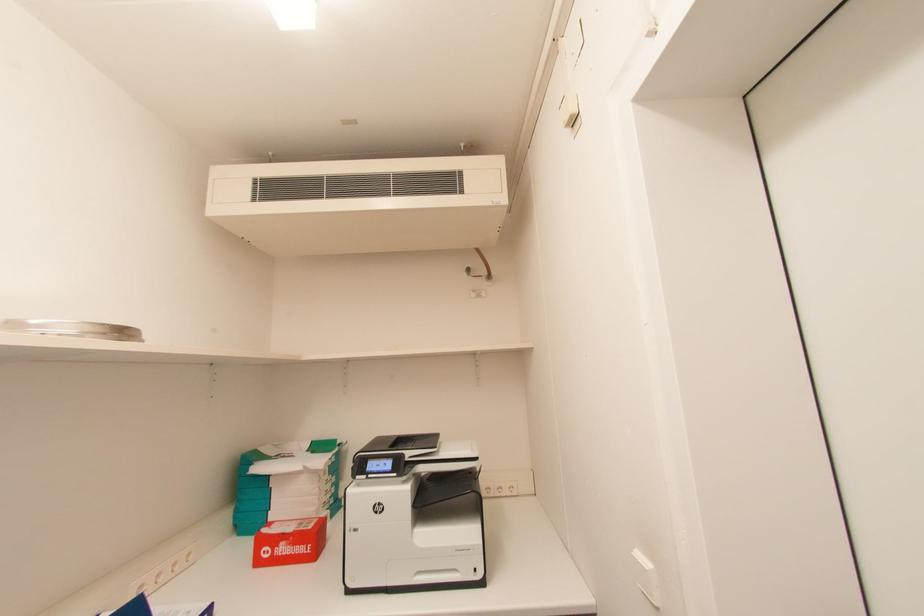
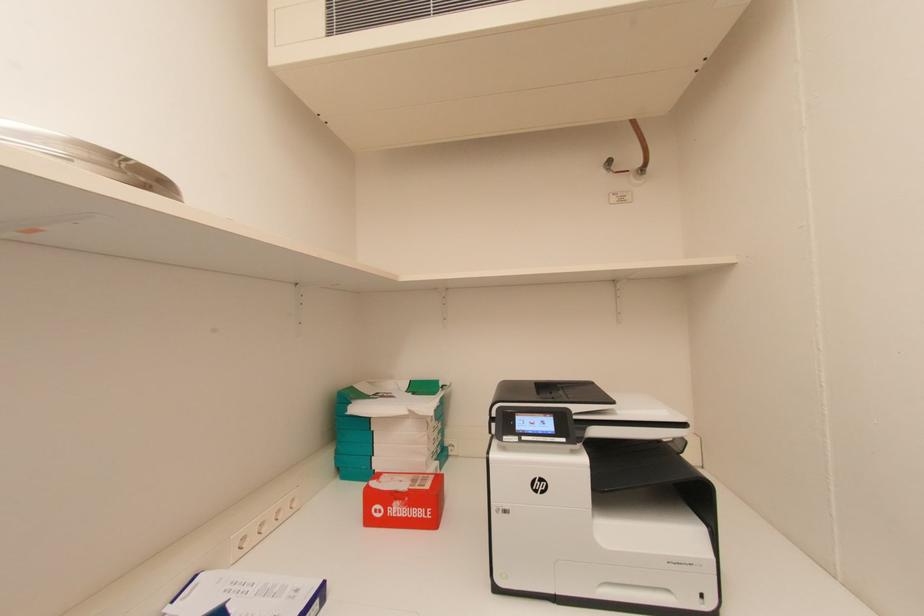
What movement of the cameraman would produce the second image?

The cameraman moved toward left, forward.